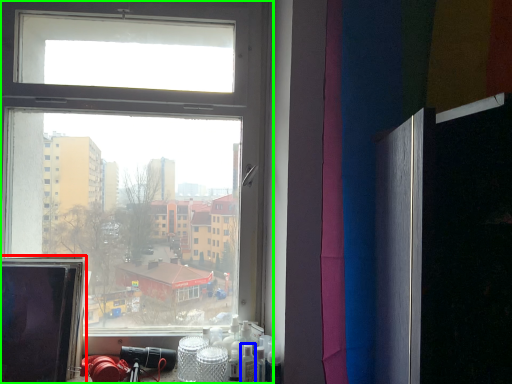
Question: Based on their relative distances, which object is farther from computer screen (highlighted by a red box)? Choose from toiletry (highlighted by a blue box) and window (highlighted by a green box).

Choices:
 (A) toiletry
 (B) window

Answer: (A)